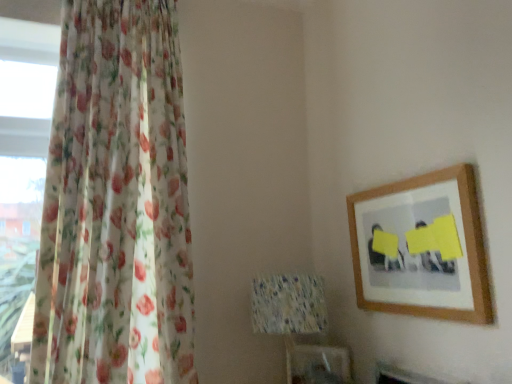
Question: From a real-world perspective, relative to speckled fabric lampshade at center, is floral sheer curtain at left vertically above or below?

Choices:
 (A) above
 (B) below

Answer: (A)

Question: Which is correct: floral sheer curtain at left is inside speckled fabric lampshade at center, or outside of it?

Choices:
 (A) outside
 (B) inside

Answer: (A)

Question: Which object is the closest to the speckled fabric lampshade at center?

Choices:
 (A) wooden picture frame at upper right
 (B) floral sheer curtain at left

Answer: (A)

Question: Considering the real-world distances, which object is closest to the floral sheer curtain at left?

Choices:
 (A) speckled fabric lampshade at center
 (B) wooden picture frame at upper right

Answer: (A)